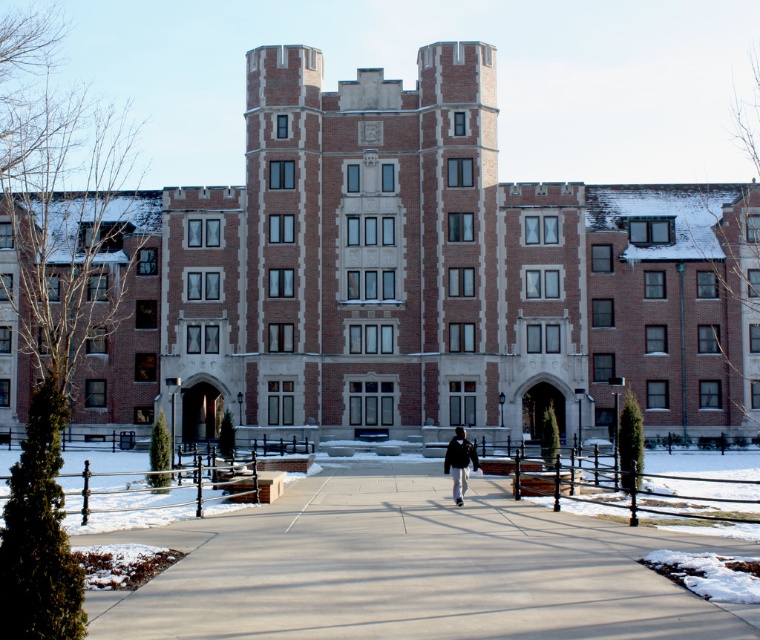
You are standing on the walkway in front of the building and see the concrete at center and the black matte jacket at center. Which one is more to the left?

The concrete at center is more to the left.

You are standing on the walkway in front of the building and notice both the concrete at center and the black matte jacket at center. Which object is nearer to you?

The concrete at center is closer to the viewer than the black matte jacket at center, so the concrete at center is nearer to you.

You are standing on the walkway in front of the building and see both the concrete at center and the black matte jacket at center. Which object is wider?

The concrete at center is wider than the black matte jacket at center.